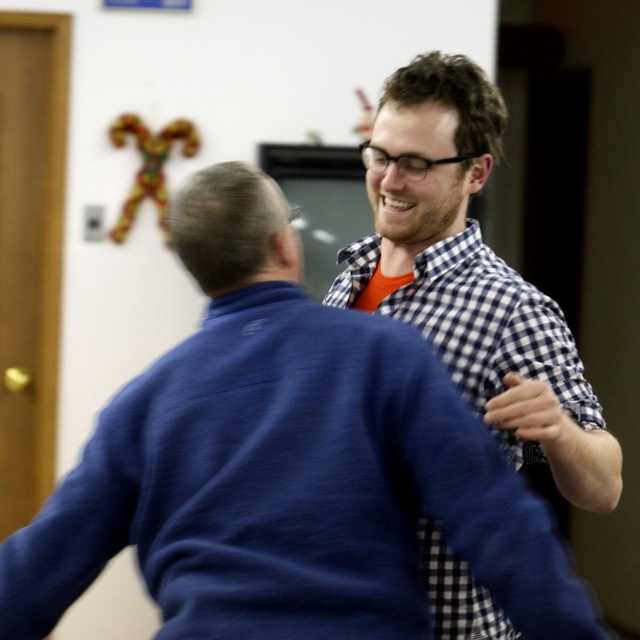
Consider the image. You are organizing a clothing rack and need to place the checkered fabric shirt at upper right and the white checkered shirt at right. Based on their widths, which one should you place on the wider hanger?

The checkered fabric shirt at upper right should be placed on the wider hanger since it might be wider than the white checkered shirt at right according to the description.

You are standing at the center of the image and want to move towards the checkered fabric shirt at upper right. Which direction should you move in?

The checkered fabric shirt at upper right is located at point 0.728 on the x and y axis, so you should move towards the upper right direction to reach it.

You are a photographer trying to capture a clear photo of the checkered fabric shirt at upper right and the white checkered shirt at right. Since the shirts are overlapping, which one should you focus on to ensure the frontmost shirt is in focus?

The checkered fabric shirt at upper right is positioned under the white checkered shirt at right, so focusing on the white checkered shirt at right will ensure the frontmost shirt is in focus.